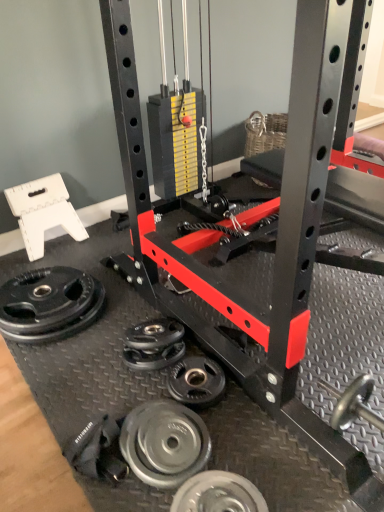
Identify the location of vacant area that is in front of silver metallic weight plate at lower center, the second wheel viewed from the top. (230, 437).